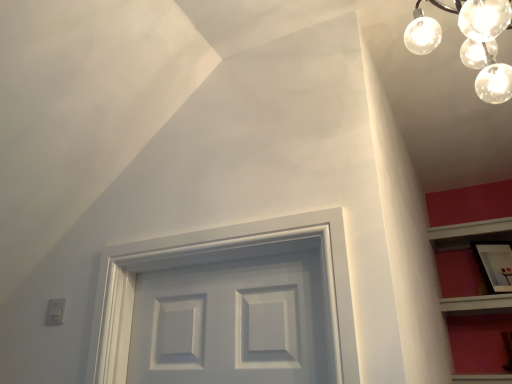
Question: From a real-world perspective, is clear glass globe at upper right physically located above or below matte black picture frame at upper right?

Choices:
 (A) above
 (B) below

Answer: (A)

Question: From the image's perspective, relative to matte black picture frame at upper right, is clear glass globe at upper right above or below?

Choices:
 (A) below
 (B) above

Answer: (B)

Question: Is clear glass globe at upper right taller or shorter than matte black picture frame at upper right?

Choices:
 (A) short
 (B) tall

Answer: (B)

Question: Is matte black picture frame at upper right wider or thinner than clear glass globe at upper right?

Choices:
 (A) wide
 (B) thin

Answer: (B)

Question: From a real-world perspective, is matte black picture frame at upper right above or below clear glass globe at upper right?

Choices:
 (A) below
 (B) above

Answer: (A)

Question: From their relative heights in the image, would you say matte black picture frame at upper right is taller or shorter than clear glass globe at upper right?

Choices:
 (A) tall
 (B) short

Answer: (B)

Question: Relative to clear glass globe at upper right, is matte black picture frame at upper right in front or behind?

Choices:
 (A) front
 (B) behind

Answer: (B)